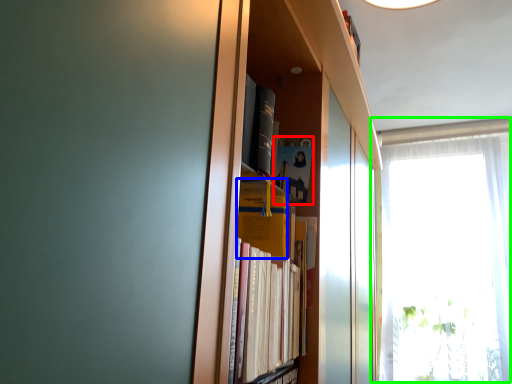
Question: Which is farther away from paperback book (highlighted by a red box)? paperback book (highlighted by a blue box) or window (highlighted by a green box)?

Choices:
 (A) paperback book
 (B) window

Answer: (B)